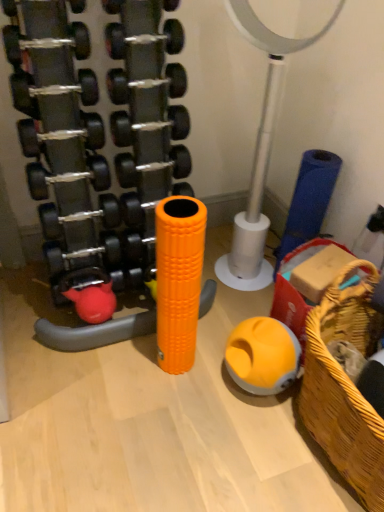
Question: Could you tell me if woven wood basket at lower right is turned towards orange foam roller at center, marked as the first toy in a left-to-right arrangement?

Choices:
 (A) yes
 (B) no

Answer: (B)

Question: Is woven wood basket at lower right touching orange foam roller at center, the 2th toy positioned from the right?

Choices:
 (A) yes
 (B) no

Answer: (B)

Question: Considering the relative sizes of woven wood basket at lower right and orange foam roller at center, marked as the first toy in a left-to-right arrangement, in the image provided, is woven wood basket at lower right shorter than orange foam roller at center, marked as the first toy in a left-to-right arrangement,?

Choices:
 (A) no
 (B) yes

Answer: (B)

Question: Does woven wood basket at lower right have a greater width compared to orange foam roller at center, marked as the first toy in a left-to-right arrangement?

Choices:
 (A) no
 (B) yes

Answer: (B)

Question: From a real-world perspective, does woven wood basket at lower right stand above orange foam roller at center, the 2th toy positioned from the right?

Choices:
 (A) no
 (B) yes

Answer: (A)

Question: Considering the positions of rubberized yellow ball at center, which ranks as the 1th toy in right-to-left order, and metallic silver basketball hoop at center in the image, is rubberized yellow ball at center, which ranks as the 1th toy in right-to-left order, taller or shorter than metallic silver basketball hoop at center?

Choices:
 (A) tall
 (B) short

Answer: (B)

Question: In the image, is rubberized yellow ball at center, which appears as the second toy when viewed from the left, positioned in front of or behind metallic silver basketball hoop at center?

Choices:
 (A) front
 (B) behind

Answer: (B)

Question: Is rubberized yellow ball at center, which ranks as the 1th toy in right-to-left order, bigger or smaller than metallic silver basketball hoop at center?

Choices:
 (A) big
 (B) small

Answer: (B)

Question: Is point (251, 351) closer or farther from the camera than point (256, 222)?

Choices:
 (A) farther
 (B) closer

Answer: (B)

Question: From the image's perspective, relative to rubberized yellow ball at center, which appears as the second toy when viewed from the left, is metallic silver basketball hoop at center above or below?

Choices:
 (A) below
 (B) above

Answer: (B)

Question: Considering the positions of metallic silver basketball hoop at center and rubberized yellow ball at center, which appears as the second toy when viewed from the left, in the image, is metallic silver basketball hoop at center wider or thinner than rubberized yellow ball at center, which appears as the second toy when viewed from the left,?

Choices:
 (A) wide
 (B) thin

Answer: (A)

Question: Is metallic silver basketball hoop at center bigger or smaller than rubberized yellow ball at center, which ranks as the 1th toy in right-to-left order?

Choices:
 (A) big
 (B) small

Answer: (A)

Question: Is metallic silver basketball hoop at center taller or shorter than rubberized yellow ball at center, which appears as the second toy when viewed from the left?

Choices:
 (A) tall
 (B) short

Answer: (A)

Question: Is point (321, 304) closer or farther from the camera than point (276, 346)?

Choices:
 (A) closer
 (B) farther

Answer: (A)

Question: Choose the correct answer: Is woven wood basket at lower right inside rubberized yellow ball at center, which appears as the second toy when viewed from the left, or outside it?

Choices:
 (A) outside
 (B) inside

Answer: (A)